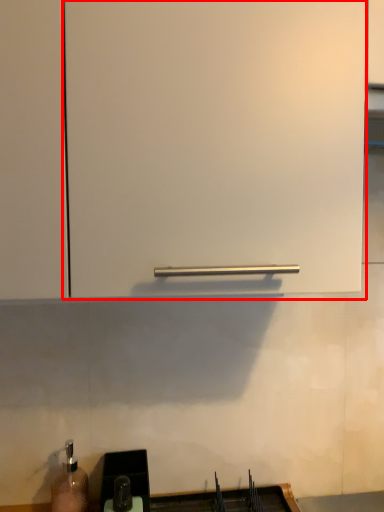
Question: Considering the relative positions of cabinetry (annotated by the red box) and sink in the image provided, where is cabinetry (annotated by the red box) located with respect to the staircase?

Choices:
 (A) right
 (B) left

Answer: (A)